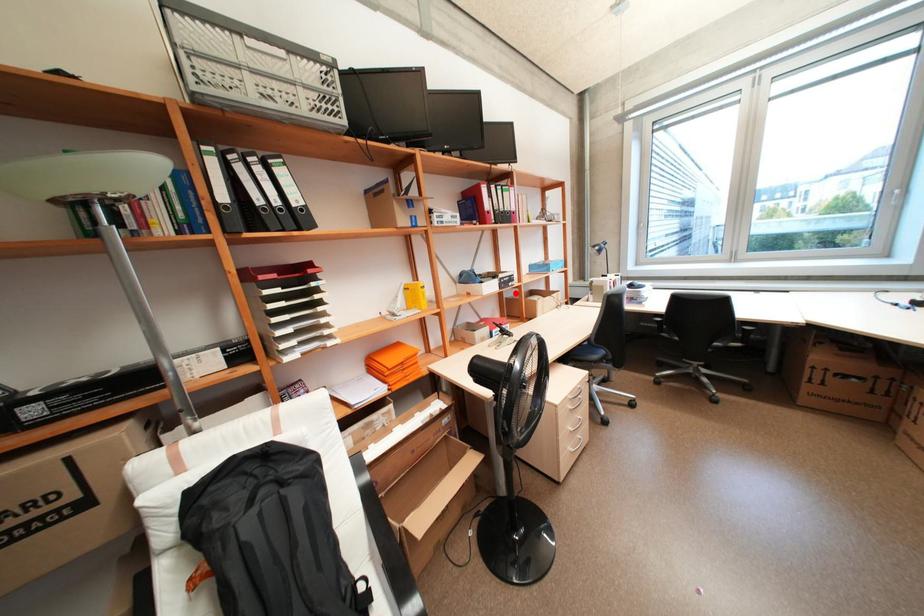
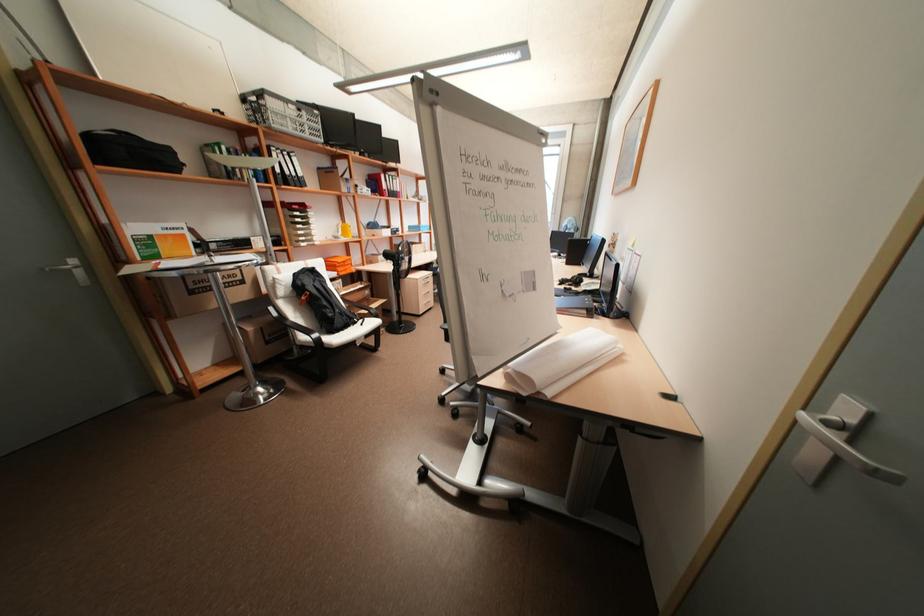
Where in the second image is the point corresponding to the highlighted location from the first image?

(403, 240)